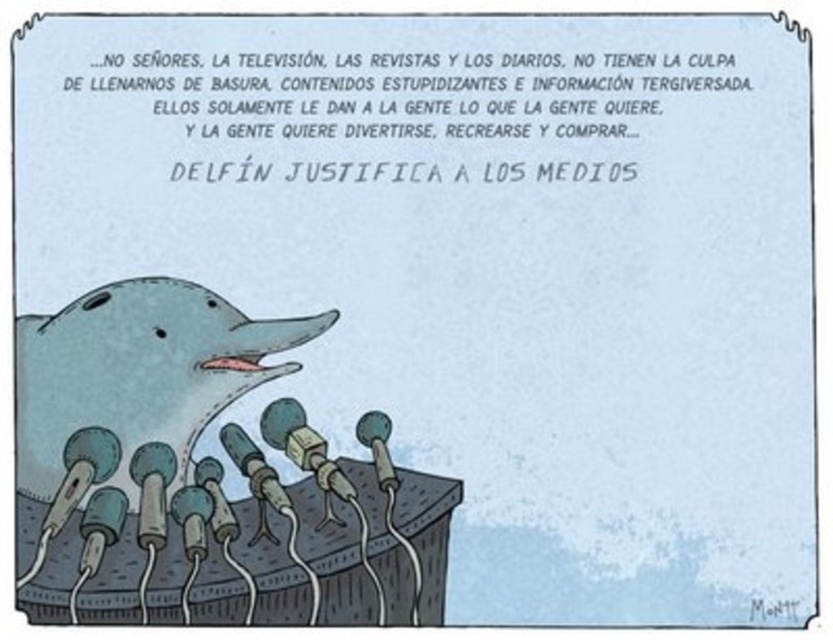
Question: Is gray matte dolphin at lower left positioned behind metallic gray microphone at center?

Choices:
 (A) no
 (B) yes

Answer: (A)

Question: Is gray matte dolphin at lower left wider than matte gray microphone at center?

Choices:
 (A) no
 (B) yes

Answer: (B)

Question: Which object appears farthest from the camera in this image?

Choices:
 (A) metallic gray microphone at center
 (B) matte gray microphone at center
 (C) gray matte dolphin at lower left

Answer: (A)

Question: Can you confirm if gray matte dolphin at lower left is bigger than matte gray microphone at center?

Choices:
 (A) no
 (B) yes

Answer: (B)

Question: Which of these objects is positioned closest to the gray matte dolphin at lower left?

Choices:
 (A) metallic gray microphone at center
 (B) matte gray microphone at center

Answer: (B)

Question: Which point is closer to the camera taking this photo?

Choices:
 (A) (193, 376)
 (B) (272, 406)
 (C) (378, 436)

Answer: (C)